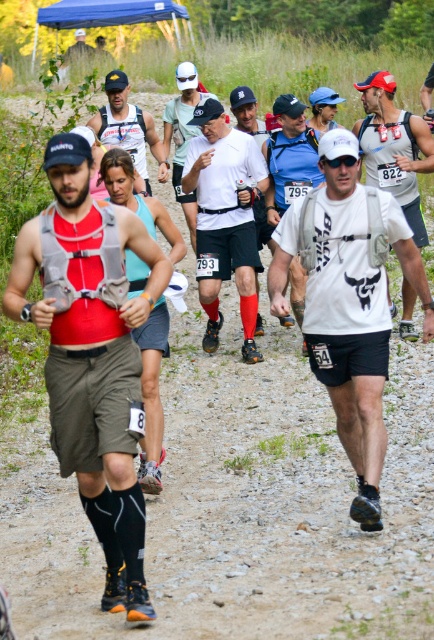
Question: Which point appears farthest from the camera in this image?

Choices:
 (A) (370, 368)
 (B) (91, 424)
 (C) (282, 125)
 (D) (154, 147)

Answer: (D)

Question: Which point is farther from the camera taking this photo?

Choices:
 (A) (311, 168)
 (B) (216, 221)

Answer: (A)

Question: Does white matte shirt at center have a larger size compared to blue fabric shirt at center?

Choices:
 (A) no
 (B) yes

Answer: (B)

Question: Is white matte t-shirt at center further to camera compared to blue fabric shirt at center?

Choices:
 (A) no
 (B) yes

Answer: (A)

Question: Among these points, which one is farthest from the camera?

Choices:
 (A) (378, 288)
 (B) (108, 314)
 (C) (273, 225)

Answer: (C)

Question: Considering the relative positions of white matte shirt at center and blue fabric shirt at center in the image provided, where is white matte shirt at center located with respect to blue fabric shirt at center?

Choices:
 (A) right
 (B) left

Answer: (B)